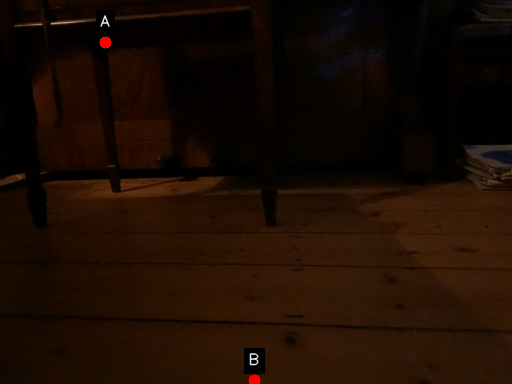
Question: Two points are circled on the image, labeled by A and B beside each circle. Which point is farther to the camera?

Choices:
 (A) A is further
 (B) B is further

Answer: (A)